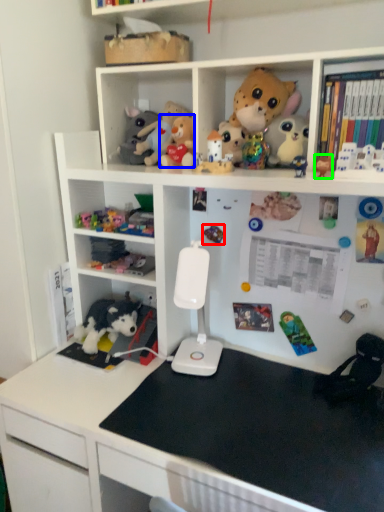
Question: Which object is the farthest from toy (highlighted by a red box)? Choose among these: toy (highlighted by a blue box) or toy (highlighted by a green box).

Choices:
 (A) toy
 (B) toy

Answer: (B)